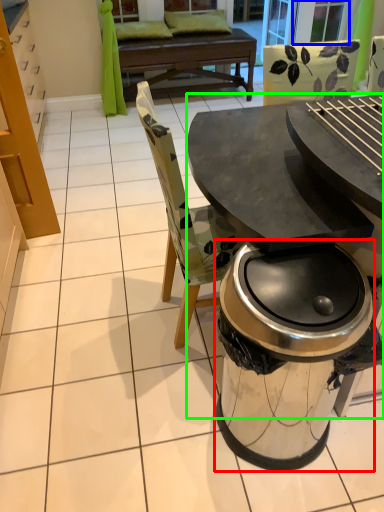
Question: Considering the real-world distances, which object is closest to trash bin/can (highlighted by a red box)? screen door (highlighted by a blue box) or table (highlighted by a green box).

Choices:
 (A) screen door
 (B) table

Answer: (B)